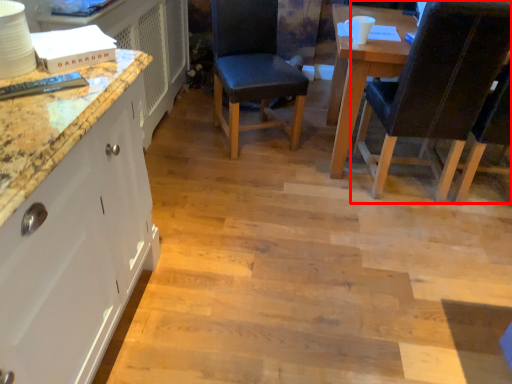
Question: Observing the image, what is the correct spatial positioning of chair (annotated by the red box) in reference to chair?

Choices:
 (A) left
 (B) right

Answer: (B)